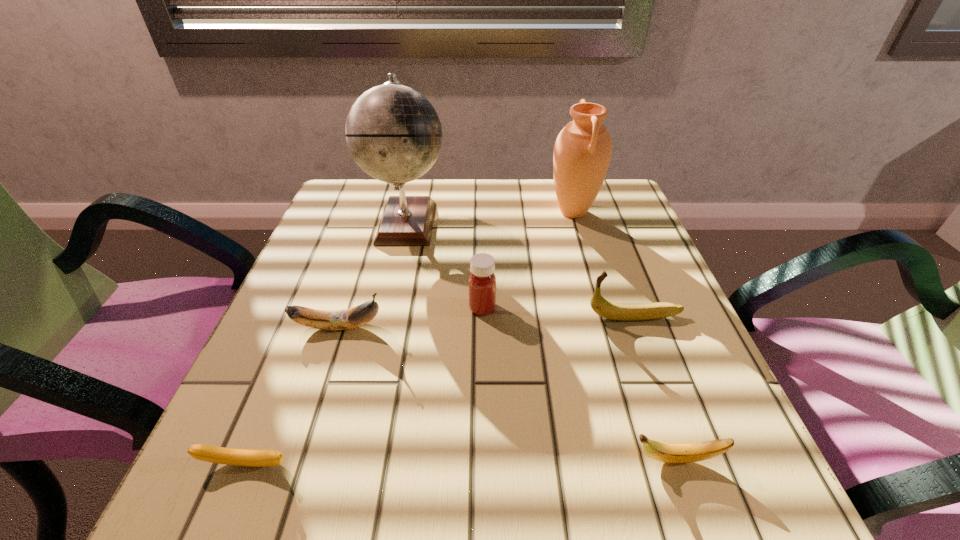
You are a GUI agent. You are given a task and a screenshot of the screen. Output one action in this format:
    pyautogui.click(x=<x>, y=<y>)
    Task: Click on the free region located 0.070m at the stem of the sixth tallest object
    Image resolution: width=960 pixels, height=540 pixels.
    Given the screenshot: What is the action you would take?
    pyautogui.click(x=579, y=460)

The height and width of the screenshot is (540, 960). I want to click on vacant region located at the stem of the shortest object, so click(x=227, y=515).

At what (x,y) coordinates should I click in order to perform the action: click on globe at the far edge. Please return your answer as a coordinate pair (x, y). The image size is (960, 540). Looking at the image, I should click on (394, 134).

The height and width of the screenshot is (540, 960). I want to click on urn located in the far edge section of the desktop, so click(582, 152).

Where is `globe present at the left edge`? The image size is (960, 540). globe present at the left edge is located at coordinates (394, 134).

Where is `urn situated at the right edge`? Image resolution: width=960 pixels, height=540 pixels. urn situated at the right edge is located at coordinates (582, 152).

Where is `object that is at the far left corner`? object that is at the far left corner is located at coordinates (394, 134).

I want to click on object located in the near left corner section of the desktop, so click(x=221, y=455).

Find the location of a particular element. This screenshot has width=960, height=540. object present at the far right corner is located at coordinates (582, 152).

Where is `object situated at the near right corner`? Image resolution: width=960 pixels, height=540 pixels. object situated at the near right corner is located at coordinates (668, 453).